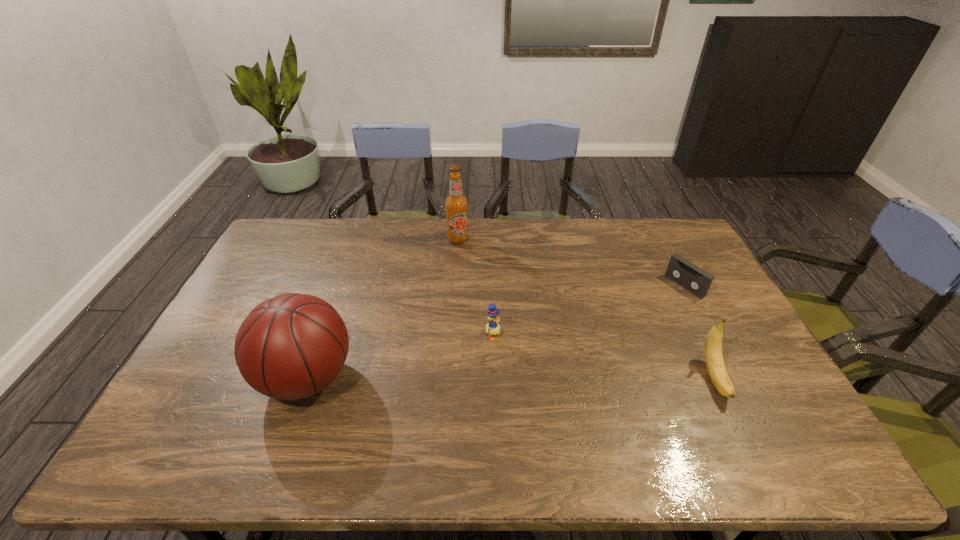
Identify the location of free space located on the front-facing side of the second farthest object. The height and width of the screenshot is (540, 960). (643, 314).

Identify the location of vacant space located 0.400m on the front-facing side of the second farthest object. (587, 348).

Identify the location of vacant point located 0.240m on the face of the second shortest object, where the monocle is placed. The width and height of the screenshot is (960, 540). click(x=572, y=383).

At what (x,y) coordinates should I click in order to perform the action: click on free location located 0.100m on the face of the second shortest object, where the monocle is placed. Please return your answer as a coordinate pair (x, y). Image resolution: width=960 pixels, height=540 pixels. Looking at the image, I should click on (528, 357).

The image size is (960, 540). I want to click on blank space located on the face of the second shortest object, where the monocle is placed, so click(546, 368).

Locate an element on the screen. This screenshot has height=540, width=960. free space located 0.200m on the front label of the farthest object is located at coordinates (468, 281).

Find the location of a particular element. free space located 0.130m on the front label of the farthest object is located at coordinates (465, 268).

Locate an element on the screen. free space located 0.250m on the front label of the farthest object is located at coordinates (470, 291).

Where is `object located at the far edge`? object located at the far edge is located at coordinates (456, 204).

Where is `basketball that is at the near edge`? Image resolution: width=960 pixels, height=540 pixels. basketball that is at the near edge is located at coordinates (289, 347).